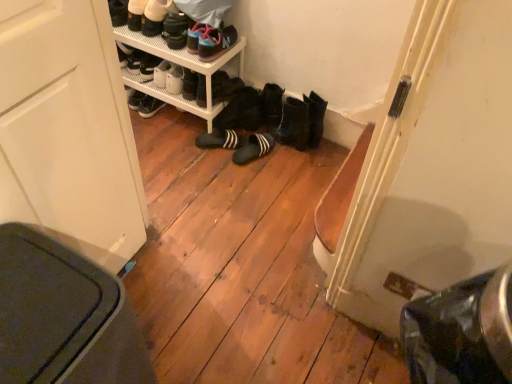
The image size is (512, 384). In order to click on blank area to the left of black suede slippers at center, placed as the 1th footwear when sorted from bottom to top in this screenshot , I will do `click(206, 146)`.